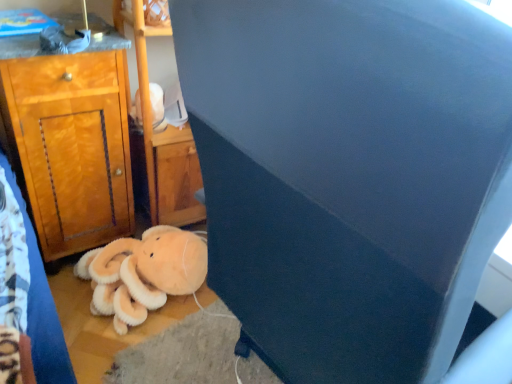
Question: In terms of size, does wooden cabinet at left appear bigger or smaller than soft orange plush at lower left?

Choices:
 (A) small
 (B) big

Answer: (B)

Question: From the image's perspective, is wooden cabinet at left above or below soft orange plush at lower left?

Choices:
 (A) above
 (B) below

Answer: (A)

Question: Which object is the farthest from the white plush toy at upper center?

Choices:
 (A) soft orange plush at lower left
 (B) dark blue fabric at center
 (C) wooden cabinet at left

Answer: (B)

Question: Based on their relative distances, which object is farther from the white plush toy at upper center?

Choices:
 (A) dark blue fabric at center
 (B) soft orange plush at lower left
 (C) wooden cabinet at left

Answer: (A)